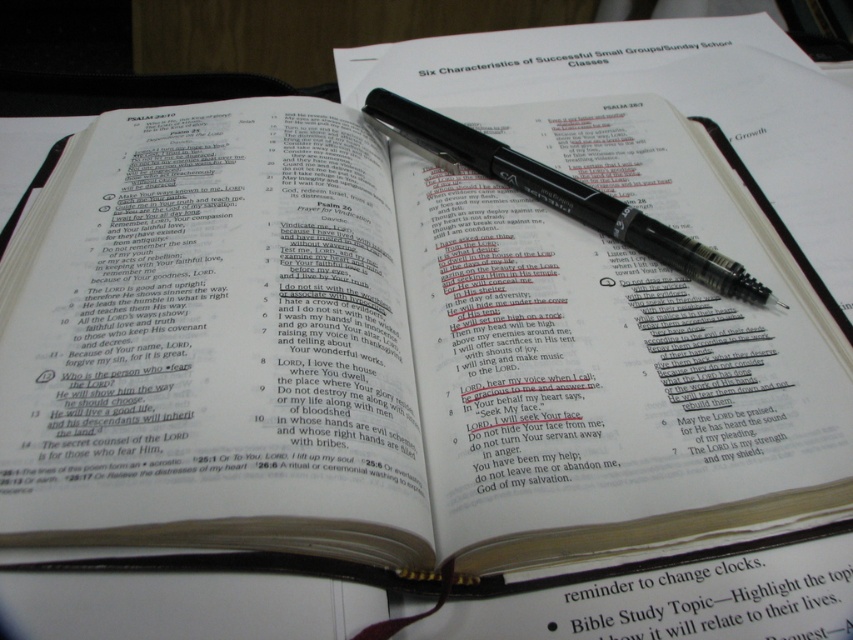
You are a student trying to locate the point marked on the image. Based on the scene description, where would the point labeled as point (x=718, y=598) be located?

The point (x=718, y=598) is on the white paper at center.

You are organizing a study session and need to place the black plastic pen at center and the white paper at upper center on a desk. Based on the scene, where should you position them relative to each other?

The black plastic pen at center should be placed below the white paper at upper center, as shown in the scene.